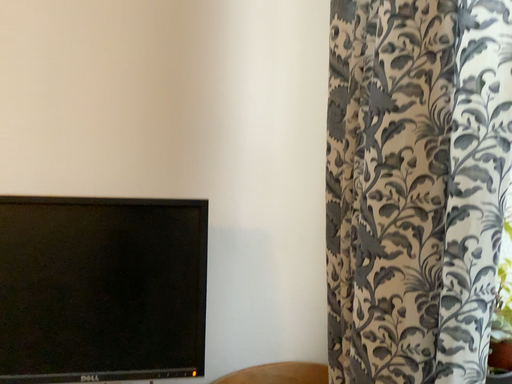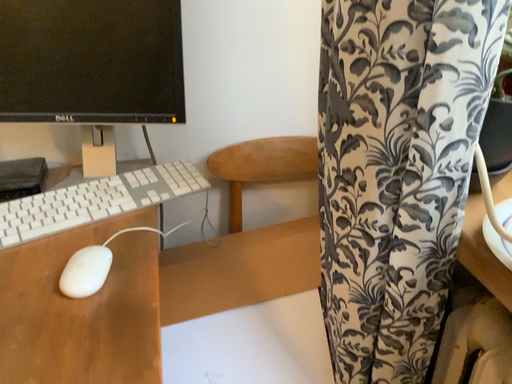
Question: How did the camera likely rotate when shooting the video?

Choices:
 (A) rotated downward
 (B) rotated upward

Answer: (A)